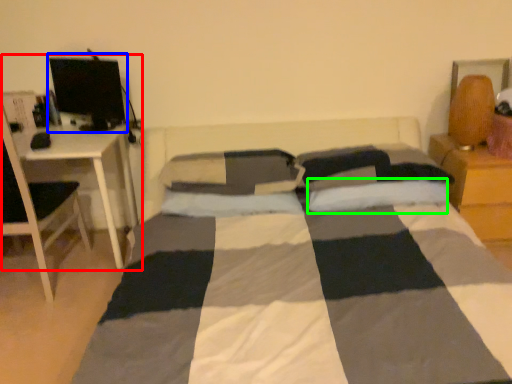
Question: Considering the real-world distances, which object is closest to computer desk (highlighted by a red box)? computer monitor (highlighted by a blue box) or pillow (highlighted by a green box).

Choices:
 (A) computer monitor
 (B) pillow

Answer: (A)